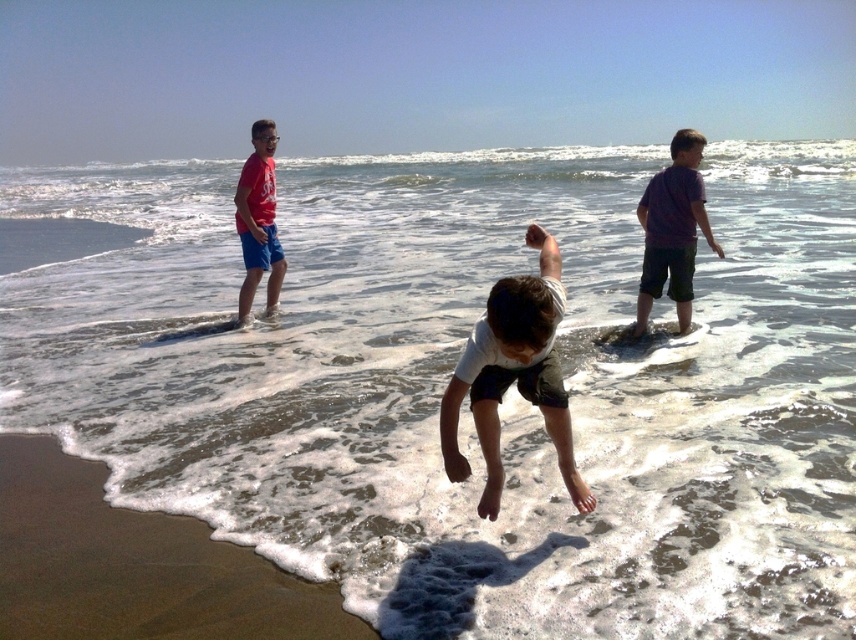
Who is lower down, purple cotton shirt at right or matte red t-shirt at left?

purple cotton shirt at right is below.

In the scene shown: Which is more to the right, purple cotton shirt at right or matte red t-shirt at left?

From the viewer's perspective, purple cotton shirt at right appears more on the right side.

The width and height of the screenshot is (856, 640). I want to click on purple cotton shirt at right, so click(672, 228).

In order to click on purple cotton shirt at right in this screenshot , I will do `click(672, 228)`.

Looking at this image, does brown sandy beach at lower left have a lesser width compared to matte red t-shirt at left?

In fact, brown sandy beach at lower left might be wider than matte red t-shirt at left.

Can you confirm if brown sandy beach at lower left is shorter than matte red t-shirt at left?

Yes.

I want to click on brown sandy beach at lower left, so click(x=135, y=564).

Measure the distance from brown sandy beach at lower left to purple cotton shirt at right.

brown sandy beach at lower left is 5.04 meters from purple cotton shirt at right.

Does brown sandy beach at lower left have a greater width compared to purple cotton shirt at right?

Correct, the width of brown sandy beach at lower left exceeds that of purple cotton shirt at right.

Locate an element on the screen. This screenshot has width=856, height=640. brown sandy beach at lower left is located at coordinates (135, 564).

Where is `brown sandy beach at lower left`? The height and width of the screenshot is (640, 856). brown sandy beach at lower left is located at coordinates (135, 564).